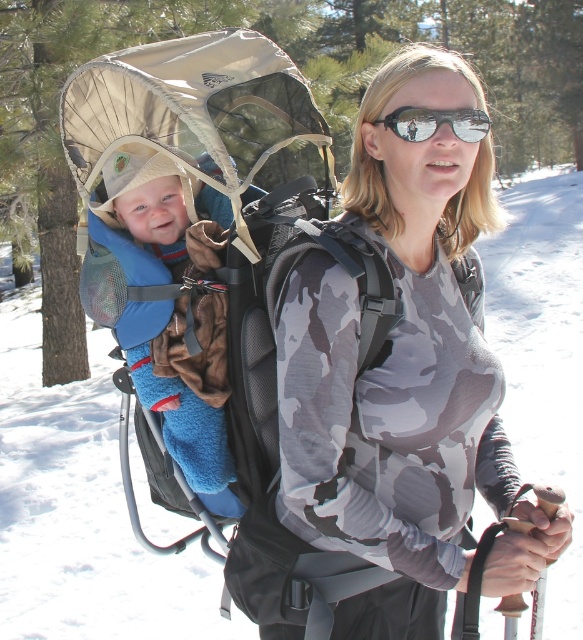
The woman is wearing a camouflage fabric shirt at center and sunglasses at center. Which item is closer to the viewer?

The camouflage fabric shirt at center is closer to the viewer because it is in front of the sunglasses at center.

The woman is wearing a camouflage fabric shirt at center and sunglasses at center. Which item is positioned lower on her body?

The camouflage fabric shirt at center is positioned below the sunglasses at center, so the camouflage fabric shirt at center is lower.